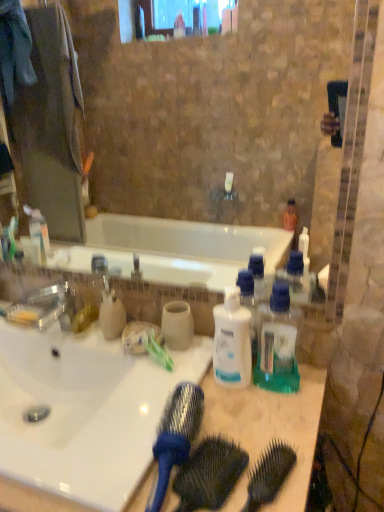
At what (x,y) coordinates should I click in order to perform the action: click on free spot in front of green plastic toothbrush at center. Please return your answer as a coordinate pair (x, y). Looking at the image, I should click on click(156, 414).